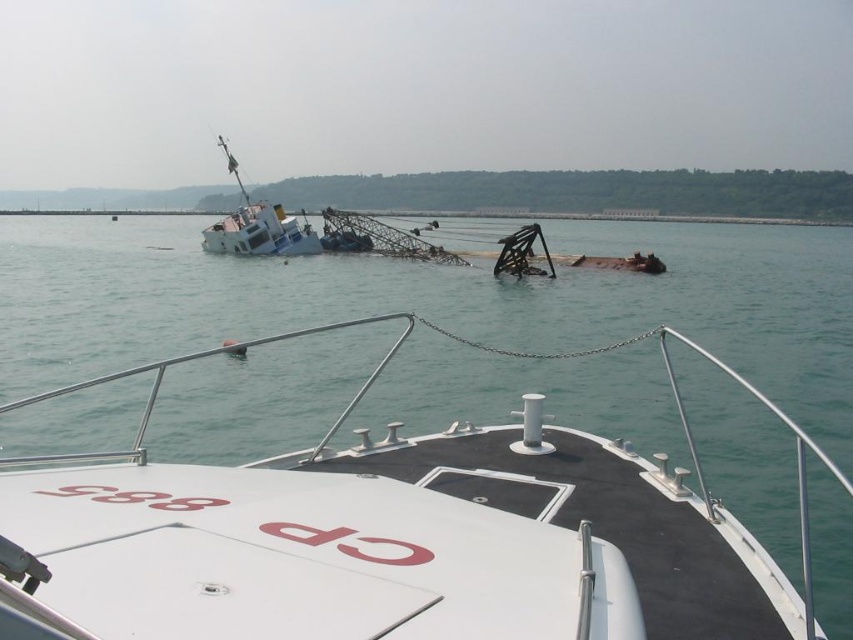
Looking at this image, does white matte boat at center have a greater width compared to white matte ship at left?

Indeed, white matte boat at center has a greater width compared to white matte ship at left.

Does white matte boat at center have a smaller size compared to white matte ship at left?

No, white matte boat at center is not smaller than white matte ship at left.

Is point (763, 566) in front of point (238, 241)?

Yes, point (763, 566) is closer to viewer.

Locate an element on the screen. This screenshot has width=853, height=640. white matte boat at center is located at coordinates (392, 536).